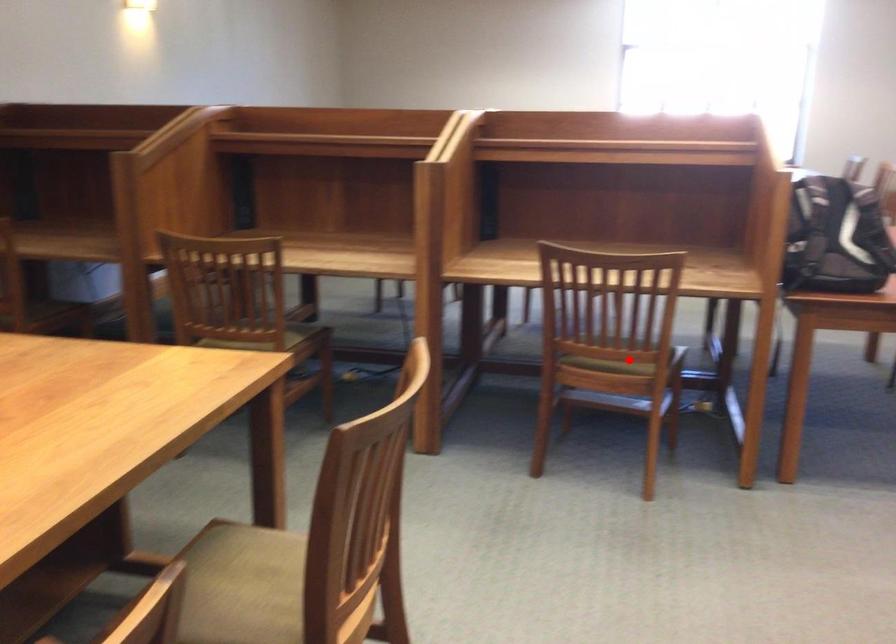
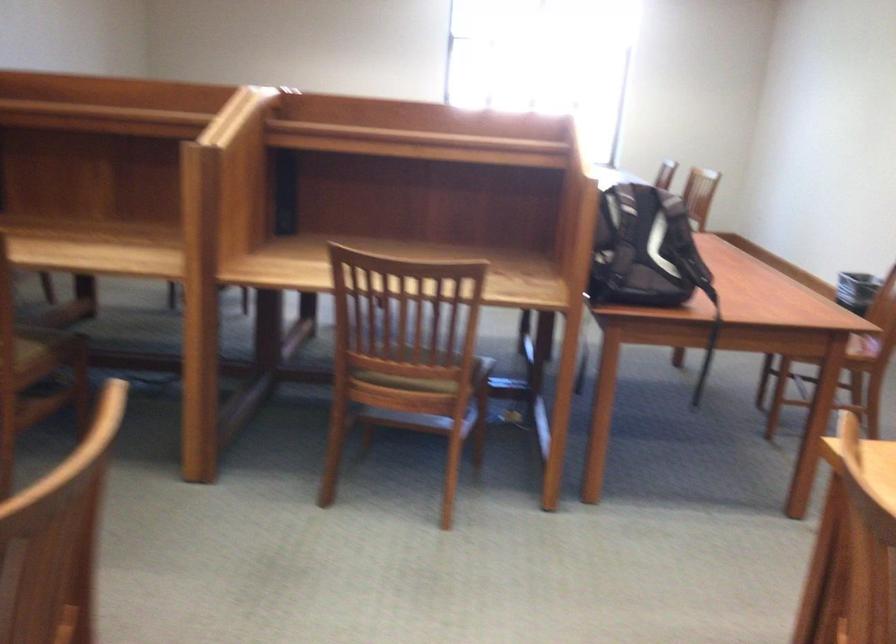
Locate, in the second image, the point that corresponds to the highlighted location in the first image.

(421, 379)